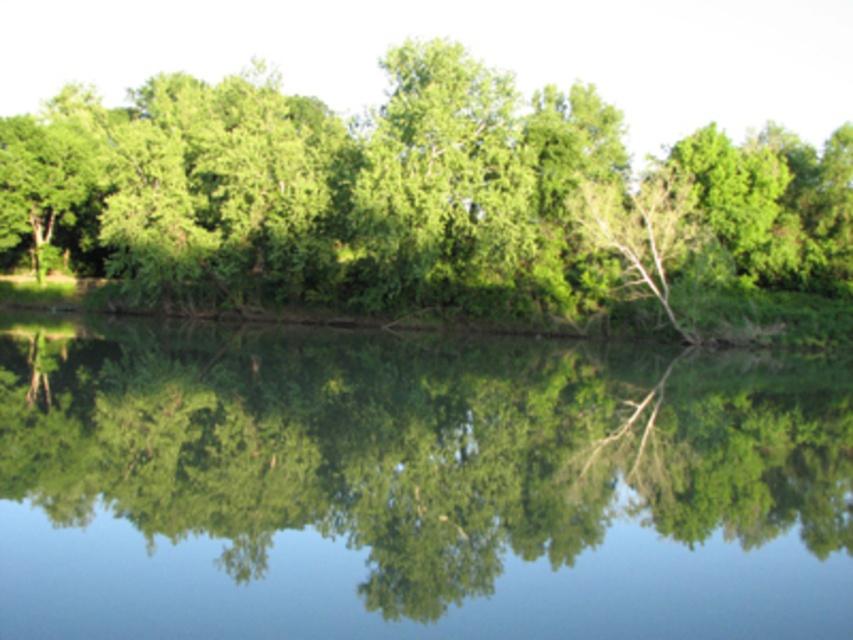
Question: Is green reflective water at center to the left of green leafy tree at center from the viewer's perspective?

Choices:
 (A) yes
 (B) no

Answer: (B)

Question: Which point appears closest to the camera in this image?

Choices:
 (A) (554, 259)
 (B) (67, 499)

Answer: (B)

Question: From the image, what is the correct spatial relationship of green reflective water at center in relation to green leafy tree at center?

Choices:
 (A) below
 (B) above

Answer: (A)

Question: Observing the image, what is the correct spatial positioning of green reflective water at center in reference to green leafy tree at center?

Choices:
 (A) above
 (B) below

Answer: (B)

Question: Which object is farther from the camera taking this photo?

Choices:
 (A) green reflective water at center
 (B) green leafy tree at center

Answer: (B)